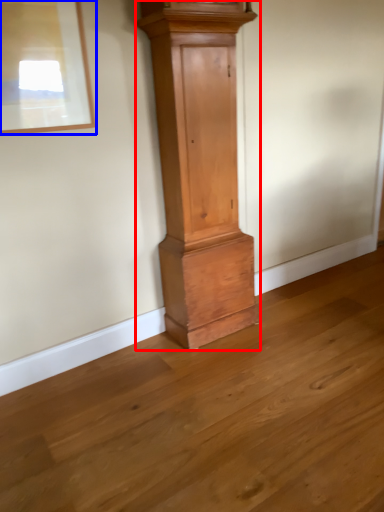
Question: Which of the following is the closest to the observer, furniture (highlighted by a red box) or picture frame (highlighted by a blue box)?

Choices:
 (A) furniture
 (B) picture frame

Answer: (B)